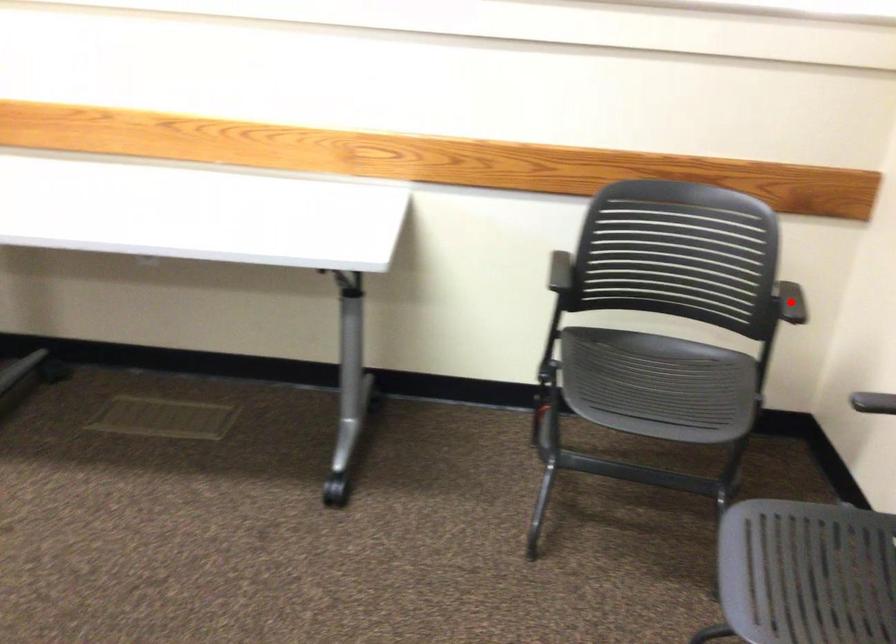
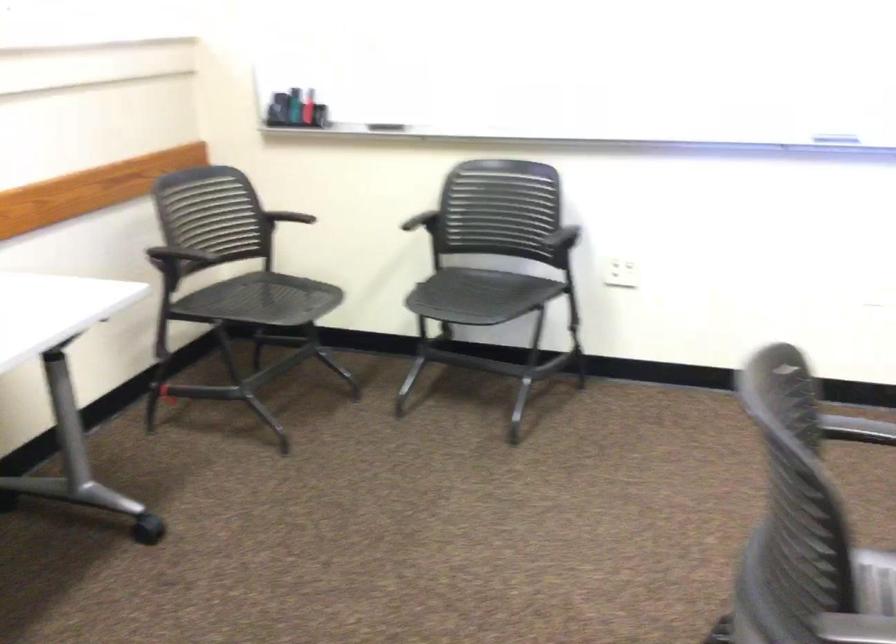
Question: I am providing you with two images of the same scene from different viewpoints. A red point is shown in image1. For the corresponding object point in image2, is it positioned nearer or farther from the camera?

Choices:
 (A) Nearer
 (B) Farther

Answer: (B)